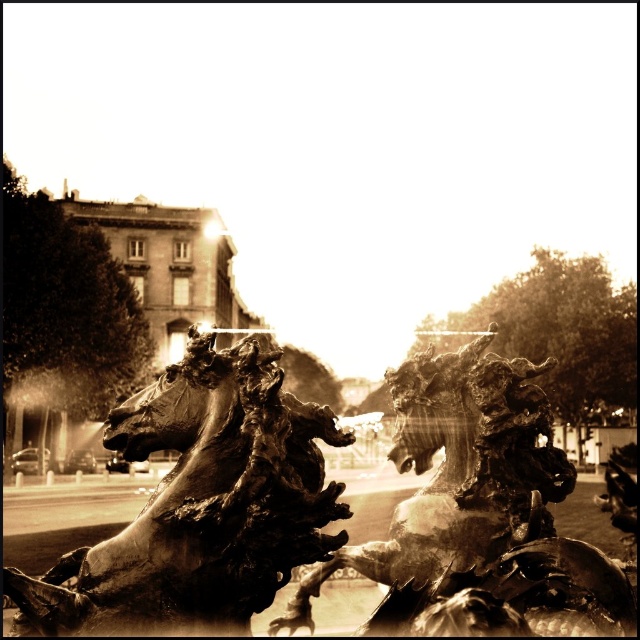
Question: Among these objects, which one is farthest from the camera?

Choices:
 (A) bronze horse at center
 (B) bronze dragon at center

Answer: (B)

Question: Which point appears farthest from the camera in this image?

Choices:
 (A) (449, 531)
 (B) (68, 576)

Answer: (A)

Question: Is bronze horse at center to the right of bronze dragon at center from the viewer's perspective?

Choices:
 (A) no
 (B) yes

Answer: (A)

Question: Does bronze horse at center appear under bronze dragon at center?

Choices:
 (A) no
 (B) yes

Answer: (A)

Question: Is bronze horse at center smaller than bronze dragon at center?

Choices:
 (A) no
 (B) yes

Answer: (A)

Question: Which point is farther to the camera?

Choices:
 (A) click(x=435, y=532)
 (B) click(x=196, y=396)

Answer: (A)